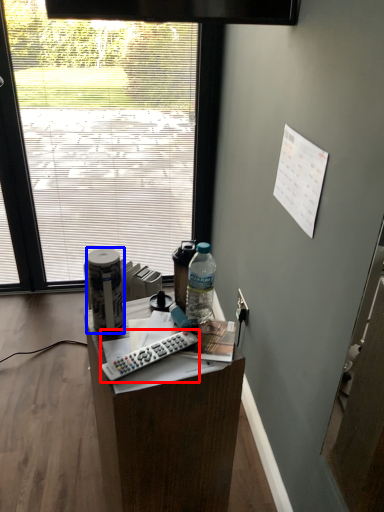
Question: Among these objects, which one is farthest to the camera, remote control (highlighted by a red box) or bottle (highlighted by a blue box)?

Choices:
 (A) remote control
 (B) bottle

Answer: (B)